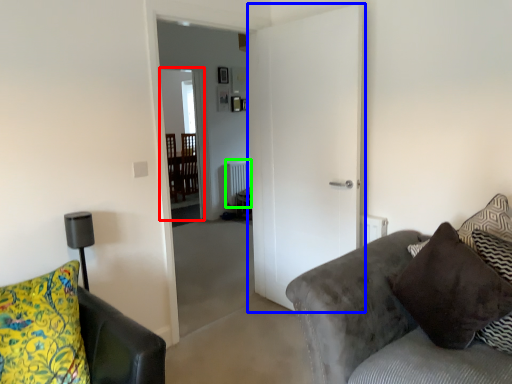
Question: Which is nearer to the glass door (highlighted by a red box)? door (highlighted by a blue box) or radiator (highlighted by a green box).

Choices:
 (A) door
 (B) radiator

Answer: (B)